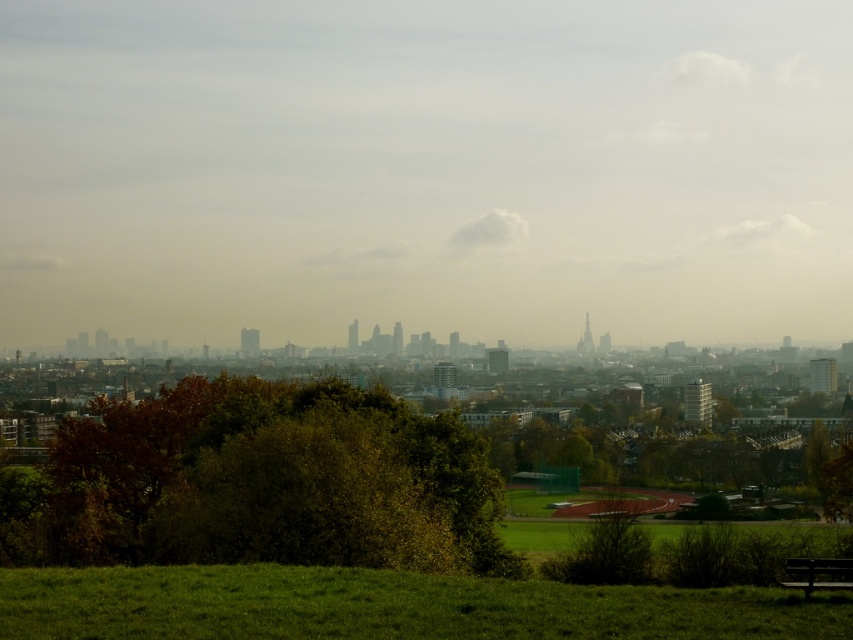
Who is more forward, (445,609) or (798,561)?

Point (445,609) is more forward.

Who is more distant from viewer, (207, 624) or (816, 580)?

The point (816, 580) is more distant.

Where is `green grassy field at lower center`? The height and width of the screenshot is (640, 853). green grassy field at lower center is located at coordinates (389, 605).

Can you confirm if green leafy tree at center is smaller than green grassy field at lower center?

Actually, green leafy tree at center might be larger than green grassy field at lower center.

Between point (413, 440) and point (253, 611), which one is positioned in front?

Point (253, 611)

Where is `green leafy tree at center`? The height and width of the screenshot is (640, 853). green leafy tree at center is located at coordinates (274, 481).

Who is lower down, green leafy tree at center or wooden bench at lower right?

Positioned lower is green leafy tree at center.

Who is taller, green leafy tree at center or wooden bench at lower right?

green leafy tree at center

Image resolution: width=853 pixels, height=640 pixels. What do you see at coordinates (274, 481) in the screenshot?
I see `green leafy tree at center` at bounding box center [274, 481].

Where is `green leafy tree at center`? The image size is (853, 640). green leafy tree at center is located at coordinates (274, 481).